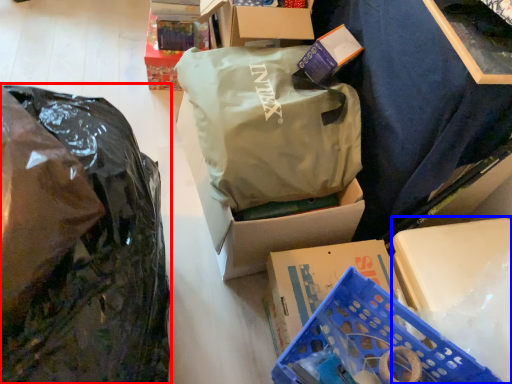
Question: Which object appears closest to the camera in this image, plastic bag (highlighted by a red box) or storage box (highlighted by a blue box)?

Choices:
 (A) plastic bag
 (B) storage box

Answer: (A)